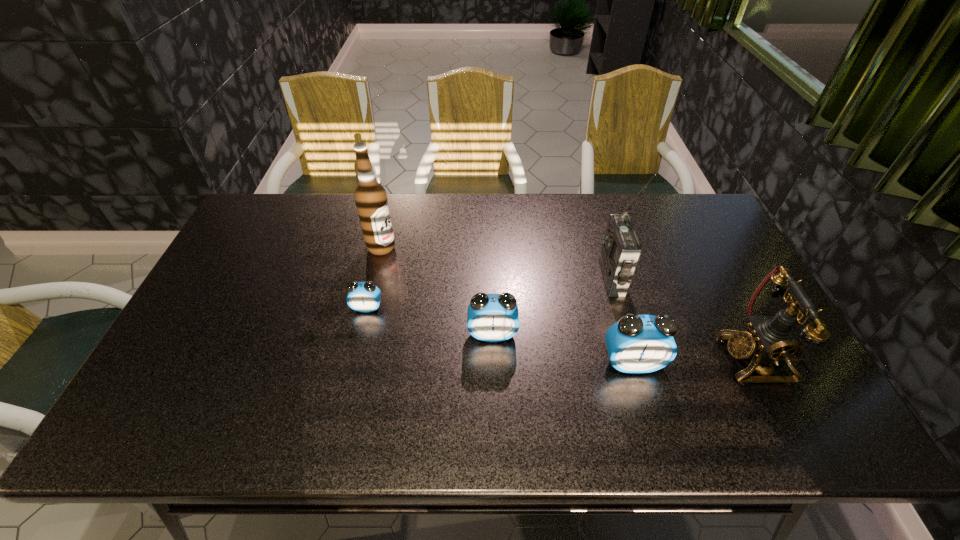
Locate an element on the screen. free point that keeps the alarm clocks evenly spaced on the right is located at coordinates [788, 396].